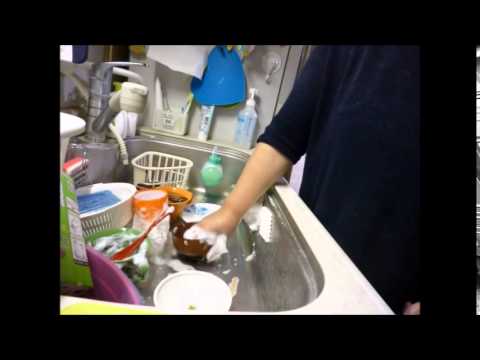
You are a GUI agent. You are given a task and a screenshot of the screen. Output one action in this format:
    pyautogui.click(x=<x>, y=<y>)
    Task: Click on the sink
    This screenshot has width=480, height=360.
    Given the screenshot: What is the action you would take?
    pyautogui.click(x=276, y=290)